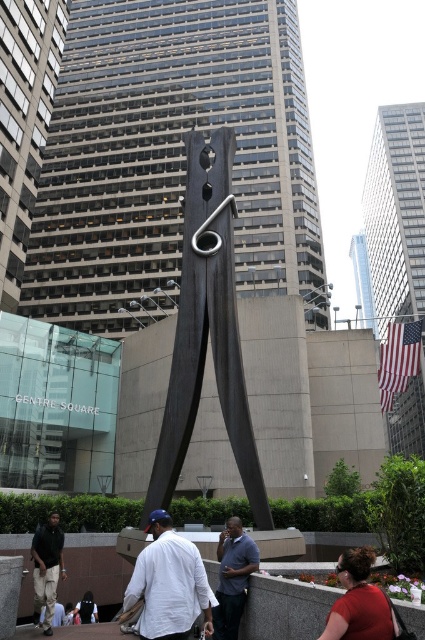
Who is positioned more to the left, white matte shirt at center or dark gray pants at lower left?

From the viewer's perspective, dark gray pants at lower left appears more on the left side.

Is point (164, 538) less distant than point (47, 541)?

Yes, it is in front of point (47, 541).

What are the coordinates of `white matte shirt at center` in the screenshot? It's located at (169, 582).

Looking at this image, between dark blue shirt at center and dark gray pants at lower left, which one is positioned higher?

dark blue shirt at center is higher up.

Is dark blue shirt at center bigger than dark gray pants at lower left?

Actually, dark blue shirt at center might be smaller than dark gray pants at lower left.

This screenshot has width=425, height=640. What do you see at coordinates (232, 577) in the screenshot?
I see `dark blue shirt at center` at bounding box center [232, 577].

This screenshot has width=425, height=640. In order to click on dark blue shirt at center in this screenshot , I will do `click(232, 577)`.

Does dark wood clothespin at center come in front of dark blue shirt at center?

No, dark wood clothespin at center is further to the viewer.

Does dark wood clothespin at center have a lesser width compared to dark blue shirt at center?

No, dark wood clothespin at center is not thinner than dark blue shirt at center.

Is point (187, 300) positioned behind point (226, 572)?

Yes, it is behind point (226, 572).

This screenshot has width=425, height=640. Identify the location of dark wood clothespin at center. click(x=206, y=330).